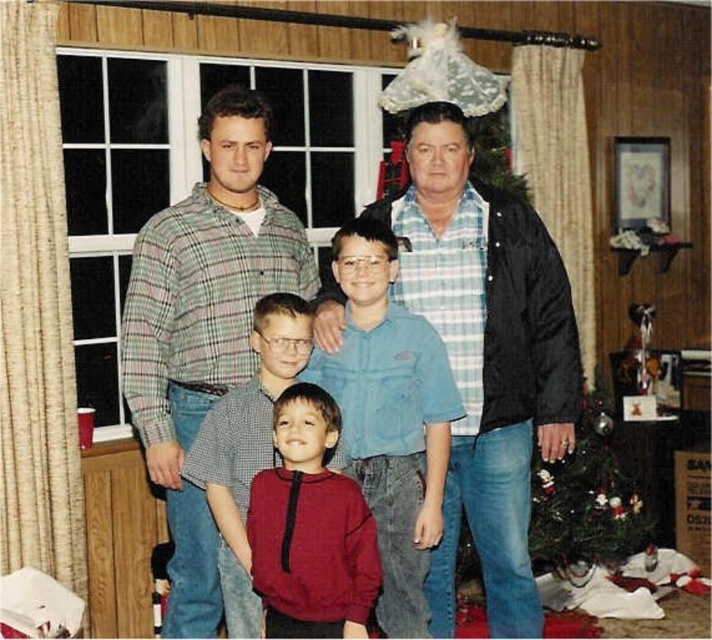
Question: Can you confirm if blue plaid shirt at center is wider than matte blue shirt at center?

Choices:
 (A) no
 (B) yes

Answer: (B)

Question: Can you confirm if green plaid shirt at upper left is positioned below matte blue shirt at center?

Choices:
 (A) no
 (B) yes

Answer: (A)

Question: Is green plaid shirt at upper left to the left of green matte christmas tree at center from the viewer's perspective?

Choices:
 (A) no
 (B) yes

Answer: (B)

Question: Which of these objects is positioned closest to the matte red sweater at center?

Choices:
 (A) blue plaid shirt at center
 (B) green plaid shirt at upper left

Answer: (B)

Question: Among these objects, which one is nearest to the camera?

Choices:
 (A) green plaid shirt at upper left
 (B) blue plaid shirt at center
 (C) blue denim shirt at center

Answer: (C)

Question: Which point is closer to the camera?

Choices:
 (A) (295, 365)
 (B) (503, 502)

Answer: (A)